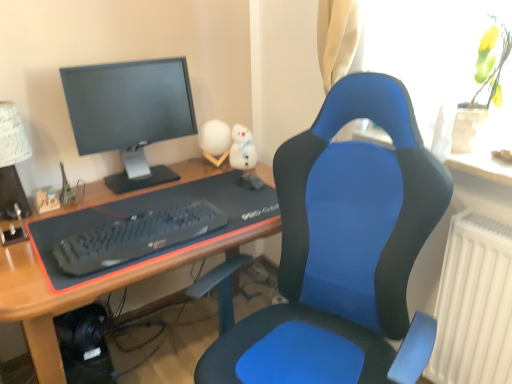
Question: Does transparent glass vase at upper right have a lesser height compared to matte black monitor at upper left?

Choices:
 (A) yes
 (B) no

Answer: (A)

Question: Is transparent glass vase at upper right outside of matte black monitor at upper left?

Choices:
 (A) yes
 (B) no

Answer: (A)

Question: Could you tell me if transparent glass vase at upper right is turned towards matte black monitor at upper left?

Choices:
 (A) no
 (B) yes

Answer: (A)

Question: Is transparent glass vase at upper right thinner than matte black monitor at upper left?

Choices:
 (A) yes
 (B) no

Answer: (B)

Question: Is transparent glass vase at upper right further to camera compared to matte black monitor at upper left?

Choices:
 (A) no
 (B) yes

Answer: (A)

Question: Is transparent glass vase at upper right closer to camera compared to matte black monitor at upper left?

Choices:
 (A) yes
 (B) no

Answer: (A)

Question: Is blue fabric desk at center shorter than white paper lampshade at upper left?

Choices:
 (A) no
 (B) yes

Answer: (A)

Question: Is blue fabric desk at center smaller than white paper lampshade at upper left?

Choices:
 (A) no
 (B) yes

Answer: (A)

Question: Is blue fabric desk at center in contact with white paper lampshade at upper left?

Choices:
 (A) no
 (B) yes

Answer: (A)

Question: Is blue fabric desk at center thinner than white paper lampshade at upper left?

Choices:
 (A) no
 (B) yes

Answer: (A)

Question: Considering the relative sizes of blue fabric desk at center and white paper lampshade at upper left in the image provided, is blue fabric desk at center wider than white paper lampshade at upper left?

Choices:
 (A) yes
 (B) no

Answer: (A)

Question: Can you confirm if blue fabric desk at center is positioned to the left of white paper lampshade at upper left?

Choices:
 (A) yes
 (B) no

Answer: (B)

Question: Is blue fabric chair at center facing away from black matte keyboard at center?

Choices:
 (A) yes
 (B) no

Answer: (B)